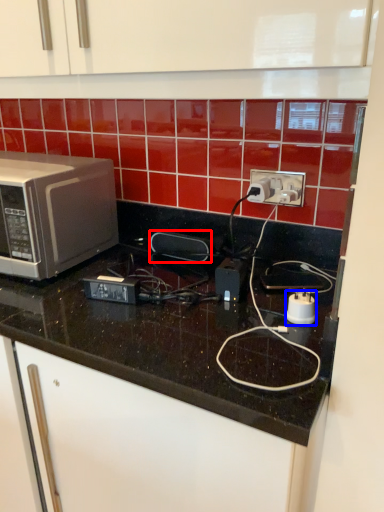
Question: Which of the following is the closest to the observer, appliance (highlighted by a red box) or appliance (highlighted by a blue box)?

Choices:
 (A) appliance
 (B) appliance

Answer: (B)